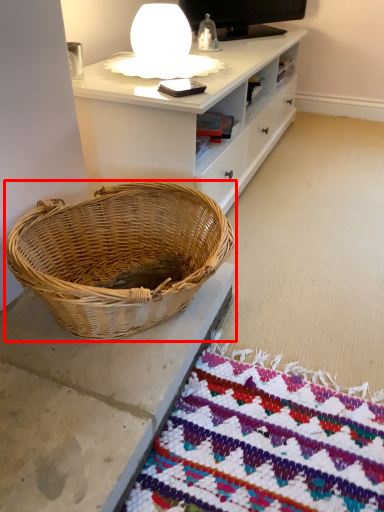
Question: From the image's perspective, what is the correct spatial positioning of picnic basket (annotated by the red box) in reference to table lamp?

Choices:
 (A) above
 (B) below

Answer: (B)